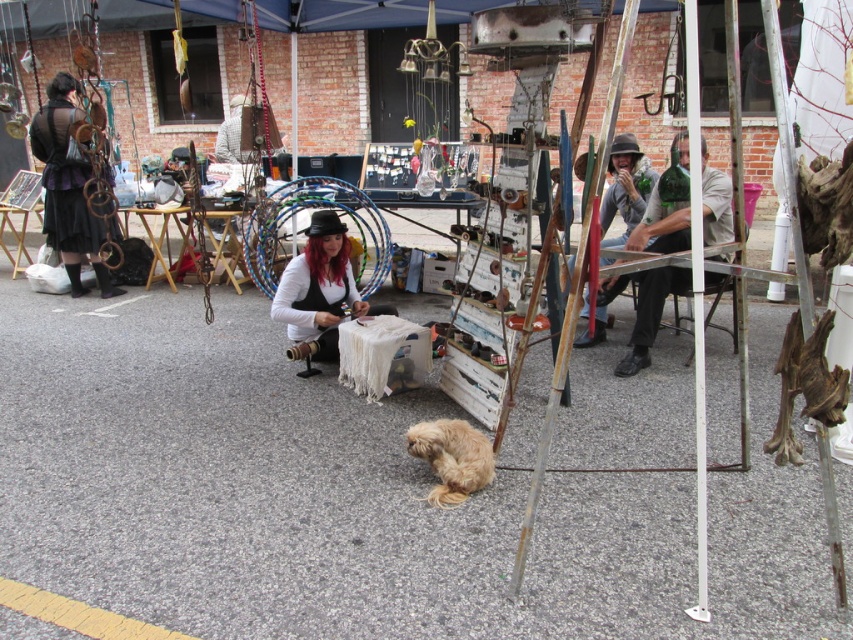
What is located at the coordinates point (x=643, y=308) in the image?

The point (x=643, y=308) marks the location of the green glass bottle at center.